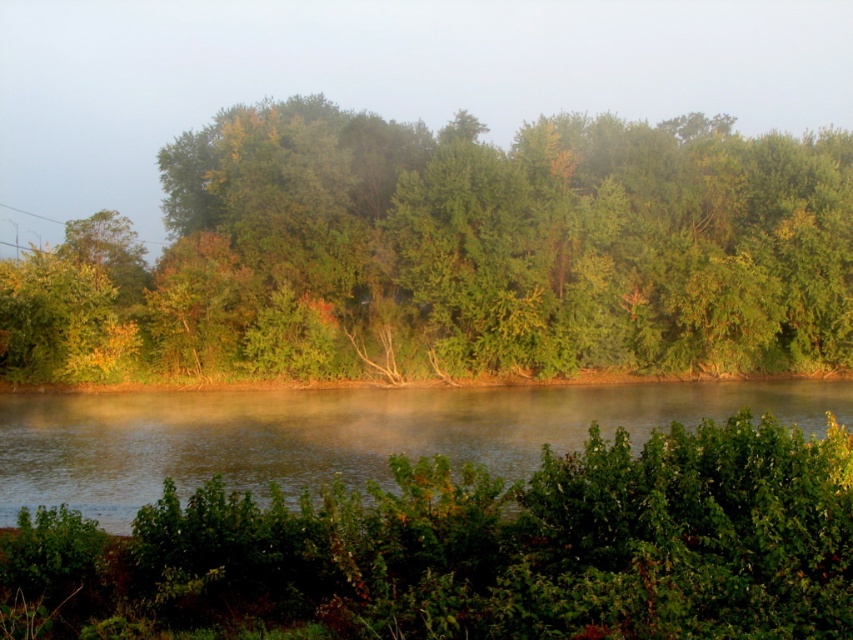
Question: Which point is closer to the camera taking this photo?

Choices:
 (A) (383, 227)
 (B) (207, 394)

Answer: (B)

Question: Observing the image, what is the correct spatial positioning of green matte trees at center in reference to foggy mist at upper center?

Choices:
 (A) right
 (B) left

Answer: (A)

Question: Estimate the real-world distances between objects in this image. Which object is closer to the foggy mist at upper center?

Choices:
 (A) smooth water at center
 (B) green matte trees at center

Answer: (B)

Question: Is green matte trees at center wider than smooth water at center?

Choices:
 (A) no
 (B) yes

Answer: (B)

Question: Which object is positioned closest to the foggy mist at upper center?

Choices:
 (A) green matte trees at center
 (B) smooth water at center

Answer: (A)

Question: Does green matte trees at center have a smaller size compared to smooth water at center?

Choices:
 (A) yes
 (B) no

Answer: (B)